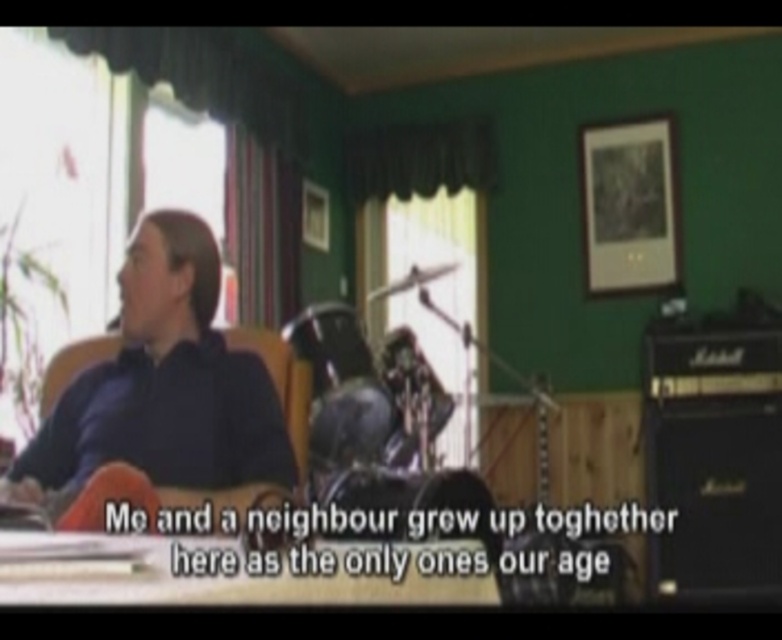
Which is in front, point (662, 472) or point (285, 368)?

Point (285, 368) is more forward.

This screenshot has height=640, width=782. Find the location of `black matte amplifier at lower right`. black matte amplifier at lower right is located at coordinates (714, 493).